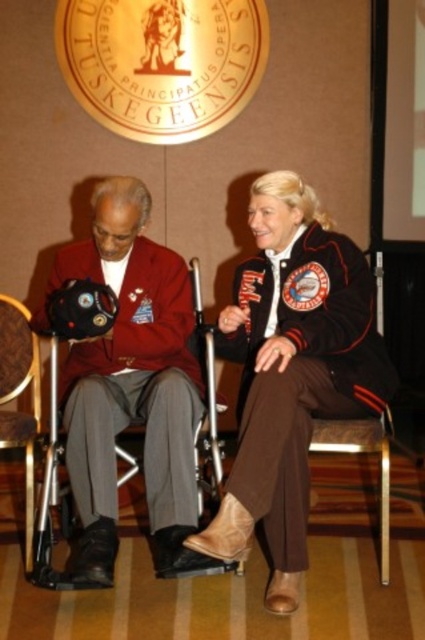
You are a photographer standing at the camera position. You want to take a closeup shot of the matte black helmet at center. Considering the distance between you and the helmet, is it possible to capture a clear closeup without moving closer?

The matte black helmet at center is 6.84 feet away from the camera. Since this distance is manageable with a standard zoom lens, you can capture a clear closeup without moving closer.

You are organizing a display for a museum exhibit and need to place the matte black helmet at center and the brown leather chair at lower left side by side. Given their widths, which object will require more horizontal space?

The matte black helmet at center requires more horizontal space because its width surpasses that of the brown leather chair at lower left.

You are an event photographer at the Tuskegee University event. You need to capture a photo of both the matte black jacket at center and the matte black helmet at center. Which object should you focus on first if you want to ensure both are in frame without moving the camera?

The matte black jacket at center is much taller than the matte black helmet at center, so you should focus on the taller jacket first to ensure it fits within the frame before adjusting for the smaller helmet.